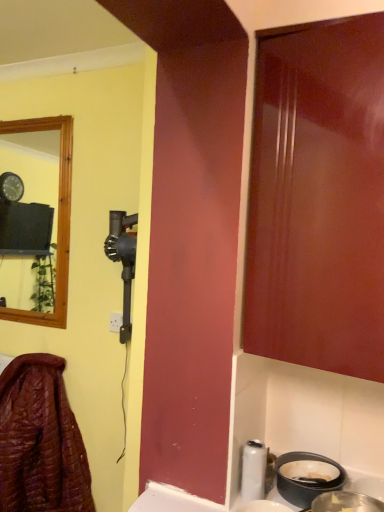
Find the location of a particular element. metallic silver basin at lower right is located at coordinates (346, 502).

What do you see at coordinates (346, 502) in the screenshot?
I see `metallic silver basin at lower right` at bounding box center [346, 502].

You are a GUI agent. You are given a task and a screenshot of the screen. Output one action in this format:
    pyautogui.click(x=<x>, y=<y>)
    Task: Click on the leather jacket at lower left
    
    Given the screenshot: What is the action you would take?
    pyautogui.click(x=40, y=440)

Measure the distance between point (17, 394) and camera.

A distance of 6.69 feet exists between point (17, 394) and camera.

Image resolution: width=384 pixels, height=512 pixels. What do you see at coordinates (40, 440) in the screenshot? I see `leather jacket at lower left` at bounding box center [40, 440].

Find the location of a particular element. This screenshot has height=512, width=384. metallic silver basin at lower right is located at coordinates pos(346,502).

Is metallic silver basin at lower right to the left of leather jacket at lower left from the viewer's perspective?

In fact, metallic silver basin at lower right is to the right of leather jacket at lower left.

Is metallic silver basin at lower right positioned in front of leather jacket at lower left?

Yes.

Which point is more distant from viewer, (350, 499) or (71, 414)?

The point (71, 414) is more distant.

From the image's perspective, which object appears higher, metallic silver basin at lower right or leather jacket at lower left?

metallic silver basin at lower right, from the image's perspective.

From a real-world perspective, between metallic silver basin at lower right and leather jacket at lower left, who is vertically lower?

In real-world perspective, leather jacket at lower left is lower.

Considering the sizes of objects metallic silver basin at lower right and leather jacket at lower left in the image provided, who is wider, metallic silver basin at lower right or leather jacket at lower left?

Wider between the two is leather jacket at lower left.

Does metallic silver basin at lower right have a lesser height compared to leather jacket at lower left?

Correct, metallic silver basin at lower right is not as tall as leather jacket at lower left.

Can you confirm if metallic silver basin at lower right is bigger than leather jacket at lower left?

Actually, metallic silver basin at lower right might be smaller than leather jacket at lower left.

Is leather jacket at lower left surrounded by metallic silver basin at lower right?

No, leather jacket at lower left is not surrounded by metallic silver basin at lower right.

In the scene shown: Is metallic silver basin at lower right far from leather jacket at lower left?

metallic silver basin at lower right is positioned a significant distance from leather jacket at lower left.

Is metallic silver basin at lower right facing towards leather jacket at lower left?

No.

Can you tell me how much metallic silver basin at lower right and leather jacket at lower left differ in facing direction?

The facing directions of metallic silver basin at lower right and leather jacket at lower left are 0.897 degrees apart.

Measure the distance between metallic silver basin at lower right and leather jacket at lower left.

1.38 meters.

You are a GUI agent. You are given a task and a screenshot of the screen. Output one action in this format:
    pyautogui.click(x=<x>, y=<y>)
    Task: Click on the basin located above the leather jacket at lower left (from a real-world perspective)
    
    Given the screenshot: What is the action you would take?
    pyautogui.click(x=346, y=502)

Which is more to the left, leather jacket at lower left or metallic silver basin at lower right?

leather jacket at lower left is more to the left.

Is the position of leather jacket at lower left less distant than that of metallic silver basin at lower right?

No, it is behind metallic silver basin at lower right.

Considering the points (3, 403) and (344, 499), which point is behind, point (3, 403) or point (344, 499)?

The point (3, 403) is farther from the camera.

From the image's perspective, does leather jacket at lower left appear higher than metallic silver basin at lower right?

Incorrect, from the image's perspective, leather jacket at lower left is lower than metallic silver basin at lower right.

From a real-world perspective, between leather jacket at lower left and metallic silver basin at lower right, who is vertically higher?

From a 3D spatial view, metallic silver basin at lower right is above.

Can you confirm if leather jacket at lower left is wider than metallic silver basin at lower right?

Correct, the width of leather jacket at lower left exceeds that of metallic silver basin at lower right.

Can you confirm if leather jacket at lower left is shorter than metallic silver basin at lower right?

No, leather jacket at lower left is not shorter than metallic silver basin at lower right.

Between leather jacket at lower left and metallic silver basin at lower right, which one has larger size?

With larger size is leather jacket at lower left.

Looking at this image, would you say leather jacket at lower left is outside metallic silver basin at lower right?

That's correct, leather jacket at lower left is outside of metallic silver basin at lower right.

Is leather jacket at lower left next to metallic silver basin at lower right and touching it?

No, leather jacket at lower left is not next to metallic silver basin at lower right.

Is leather jacket at lower left facing away from metallic silver basin at lower right?

That's not correct — leather jacket at lower left is not looking away from metallic silver basin at lower right.

How many degrees apart are the facing directions of leather jacket at lower left and metallic silver basin at lower right?

0.897 degrees separate the facing orientations of leather jacket at lower left and metallic silver basin at lower right.

Where is `laundry that is under the metallic silver basin at lower right (from a real-world perspective)`? This screenshot has height=512, width=384. laundry that is under the metallic silver basin at lower right (from a real-world perspective) is located at coordinates (40, 440).

I want to click on laundry to the left of metallic silver basin at lower right, so click(40, 440).

Where is `laundry below the metallic silver basin at lower right (from the image's perspective)`? laundry below the metallic silver basin at lower right (from the image's perspective) is located at coordinates (40, 440).